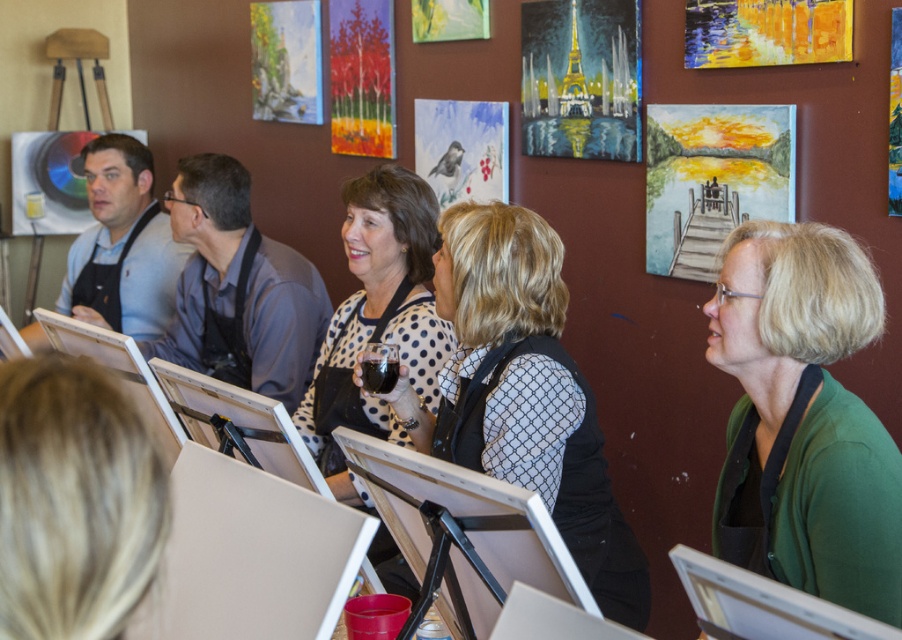
Is point (376, 124) closer to camera compared to point (291, 22)?

That is True.

Which of these two, red acrylic painting at center or pastel landscape painting at upper center, stands shorter?

pastel landscape painting at upper center is shorter.

Which is behind, point (389, 32) or point (295, 106)?

Point (295, 106)

I want to click on red acrylic painting at center, so click(x=362, y=77).

Based on the photo, is white dotted shirt at center further to the viewer compared to red acrylic painting at center?

No, it is not.

Based on the photo, is white dotted shirt at center wider than red acrylic painting at center?

Indeed, white dotted shirt at center has a greater width compared to red acrylic painting at center.

What do you see at coordinates (379, 307) in the screenshot? Image resolution: width=902 pixels, height=640 pixels. I see `white dotted shirt at center` at bounding box center [379, 307].

You are a GUI agent. You are given a task and a screenshot of the screen. Output one action in this format:
    pyautogui.click(x=<x>, y=<y>)
    Task: Click on the white dotted shirt at center
    The height and width of the screenshot is (640, 902).
    Given the screenshot: What is the action you would take?
    pyautogui.click(x=379, y=307)

Between point (619, 129) and point (275, 4), which one is positioned in front?

Point (619, 129) is in front.

Is point (545, 65) positioned before point (295, 80)?

That is True.

Which is behind, point (549, 118) or point (291, 4)?

Point (291, 4)

Locate an element on the screen. This screenshot has width=902, height=640. shiny gold tower at upper center is located at coordinates (581, 77).